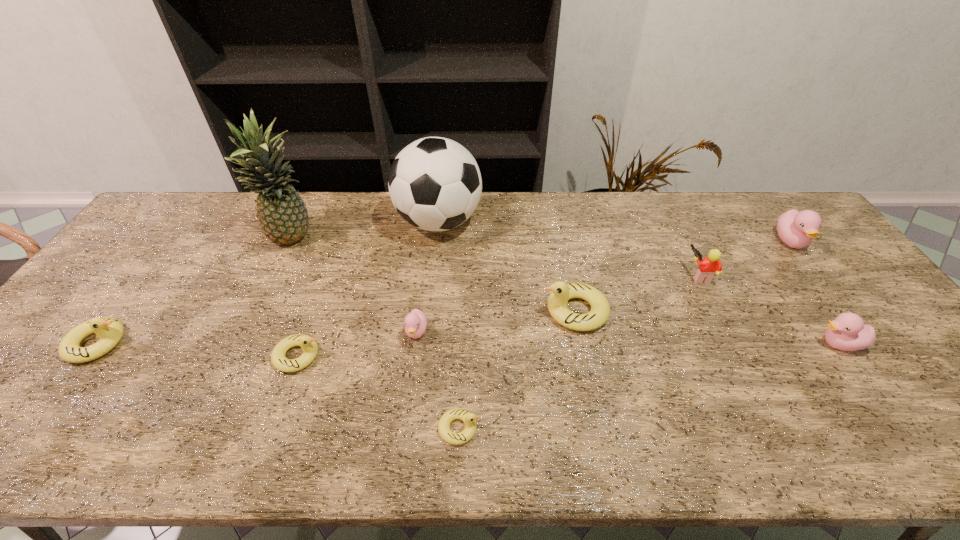
Where is `vacant space located 0.290m on the left of the soccer ball`? vacant space located 0.290m on the left of the soccer ball is located at coordinates (308, 222).

Locate an element on the screen. vacant space located 0.310m on the front-facing side of the biggest pink duckling is located at coordinates (866, 340).

Identify the location of vacant space positioned 0.070m in front of the fourth farthest object with the accessory visible. The width and height of the screenshot is (960, 540). (662, 275).

Where is `vacant region located in front of the fourth farthest object with the accessory visible`? Image resolution: width=960 pixels, height=540 pixels. vacant region located in front of the fourth farthest object with the accessory visible is located at coordinates (641, 275).

The height and width of the screenshot is (540, 960). I want to click on blank space located 0.360m in front of the fourth farthest object with the accessory visible, so click(x=563, y=275).

This screenshot has width=960, height=540. Find the location of `blank space located 0.370m on the face of the fourth object from right to left`. blank space located 0.370m on the face of the fourth object from right to left is located at coordinates pyautogui.click(x=405, y=310).

Identify the location of free space located 0.180m on the face of the fourth object from right to left. (475, 310).

Find the location of a particular element. vacant area situated on the face of the fourth object from right to left is located at coordinates (493, 310).

Where is `vacant point located on the front-facing side of the second smallest pink duckling`? vacant point located on the front-facing side of the second smallest pink duckling is located at coordinates tap(768, 344).

You are a GUI agent. You are given a task and a screenshot of the screen. Output one action in this format:
    pyautogui.click(x=<x>, y=<y>)
    Task: Click on the vacant space located 0.290m on the front-facing side of the second smallest pink duckling
    The width and height of the screenshot is (960, 540).
    Given the screenshot: What is the action you would take?
    pyautogui.click(x=700, y=344)